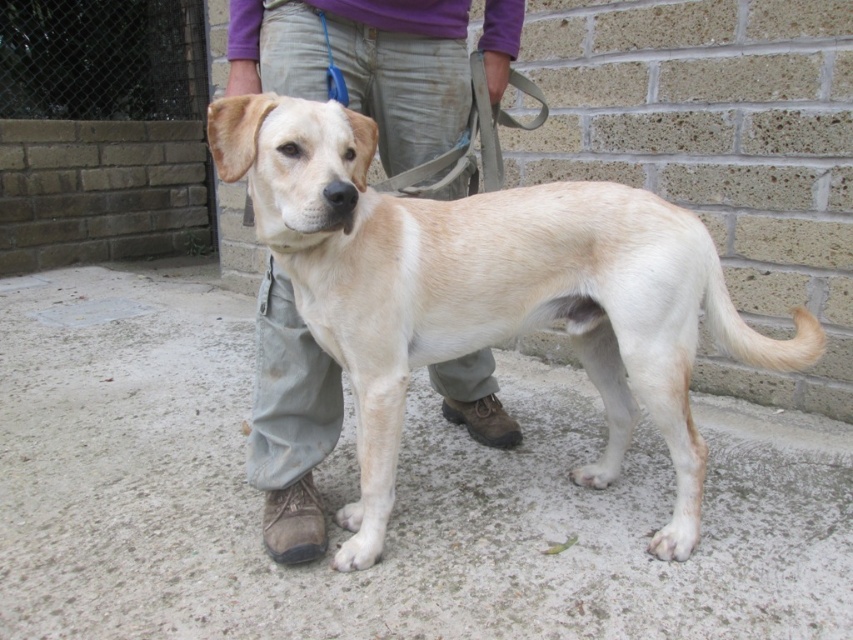
You are a dog trainer observing the scene. The dog has a light beige fur at center and the person is wearing light beige pants at center. Can the dog reach the person by moving forward without the leash interfering?

The light beige fur at center is 19.70 inches away from the light beige pants at center. Since the distance is within the typical leash length, the dog can reach the person without the leash interfering as long as it doesn

You are trying to determine which object is closer to you between the light beige fur at center and the light beige pants at center. Based on the scene, which one is nearer?

The light beige fur at center is closer to the viewer than the light beige pants at center.